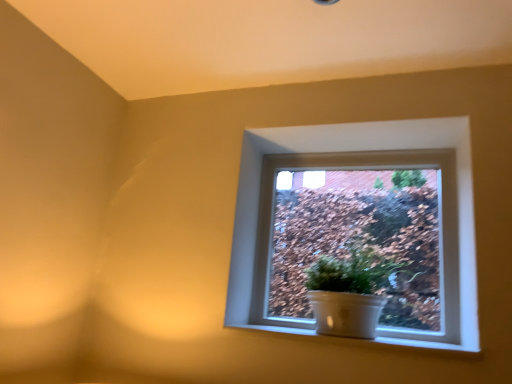
Image resolution: width=512 pixels, height=384 pixels. What do you see at coordinates (428, 344) in the screenshot?
I see `white ceramic at lower center` at bounding box center [428, 344].

Where is `white glossy pot at center`? This screenshot has width=512, height=384. white glossy pot at center is located at coordinates (354, 240).

How distant is white ceramic at lower center from white ceramic pot at center?

They are 6.70 inches apart.

From the picture: How many degrees apart are the facing directions of white ceramic at lower center and white ceramic pot at center?

They differ by 1.25 degrees in their facing directions.

Which of these two, white ceramic at lower center or white ceramic pot at center, is smaller?

white ceramic at lower center is smaller.

Is white ceramic at lower center placed right next to white ceramic pot at center?

They are not placed beside each other.

Does white glossy pot at center have a greater height compared to white ceramic at lower center?

Yes, white glossy pot at center is taller than white ceramic at lower center.

Considering the points (324, 217) and (394, 343), which point is in front, point (324, 217) or point (394, 343)?

Positioned in front is point (394, 343).

Is white glossy pot at center spatially inside white ceramic at lower center, or outside of it?

white glossy pot at center is not inside white ceramic at lower center, it's outside.

Consider the image. Is white glossy pot at center spatially inside white ceramic pot at center, or outside of it?

white glossy pot at center exists outside the volume of white ceramic pot at center.

Is point (340, 233) more distant than point (369, 255)?

That is True.

Is there a large distance between white glossy pot at center and white ceramic pot at center?

No, white glossy pot at center is not far from white ceramic pot at center.

Would you say white ceramic pot at center is outside white ceramic at lower center?

Yes, white ceramic pot at center is not within white ceramic at lower center.

Which of these two, white ceramic pot at center or white ceramic at lower center, is bigger?

white ceramic pot at center.

Does point (330, 289) come in front of point (406, 345)?

No.

Does white ceramic pot at center have a greater width compared to white ceramic at lower center?

Yes, white ceramic pot at center is wider than white ceramic at lower center.

Is white ceramic at lower center beside white glossy pot at center?

There is a gap between white ceramic at lower center and white glossy pot at center.

Is white ceramic at lower center not inside white glossy pot at center?

Indeed, white ceramic at lower center is completely outside white glossy pot at center.

Is white ceramic at lower center thinner than white glossy pot at center?

No, white ceramic at lower center is not thinner than white glossy pot at center.

How different are the orientations of white ceramic pot at center and white glossy pot at center in degrees?

The facing directions of white ceramic pot at center and white glossy pot at center are 1.07 degrees apart.

From a real-world perspective, is white ceramic pot at center positioned over white glossy pot at center based on gravity?

No, from a real-world perspective, white ceramic pot at center is not over white glossy pot at center

Consider the image. Is white ceramic pot at center bigger or smaller than white glossy pot at center?

Clearly, white ceramic pot at center is larger in size than white glossy pot at center.

At what (x,y) coordinates should I click in order to perform the action: click on window sill that is on the left side of white ceramic pot at center. Please return your answer as a coordinate pair (x, y). This screenshot has width=512, height=384. Looking at the image, I should click on (428, 344).

Locate an element on the screen. Image resolution: width=512 pixels, height=384 pixels. window sill below the white glossy pot at center (from the image's perspective) is located at coordinates (428, 344).

From the image, which object appears to be nearer to white glossy pot at center, white ceramic pot at center or white ceramic at lower center?

white ceramic pot at center lies closer to white glossy pot at center than the other object.

Based on their spatial positions, is white ceramic at lower center or white glossy pot at center closer to white ceramic pot at center?

white glossy pot at center lies closer to white ceramic pot at center than the other object.

Which object lies further to the anchor point white ceramic at lower center, white glossy pot at center or white ceramic pot at center?

white glossy pot at center is positioned further to the anchor white ceramic at lower center.

Which object lies nearer to the anchor point white ceramic at lower center, white ceramic pot at center or white glossy pot at center?

white ceramic pot at center.

Looking at the image, which one is located further to white glossy pot at center, white ceramic at lower center or white ceramic pot at center?

The object further to white glossy pot at center is white ceramic at lower center.

Which object lies nearer to the anchor point white ceramic pot at center, white glossy pot at center or white ceramic at lower center?

white glossy pot at center is positioned closer to the anchor white ceramic pot at center.

The image size is (512, 384). I want to click on houseplant located between white ceramic at lower center and white glossy pot at center in the depth direction, so click(x=350, y=291).